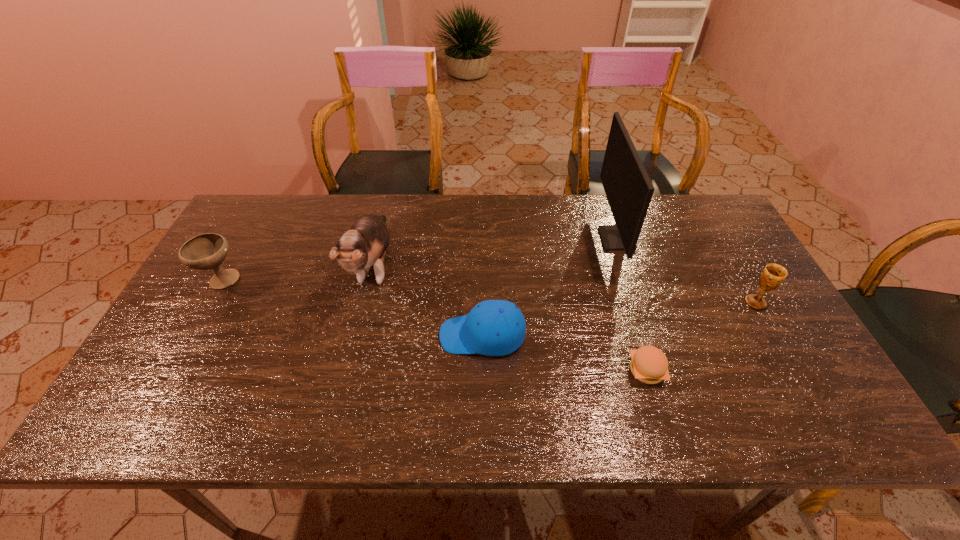
At what (x,y) coordinates should I click in order to perform the action: click on vacant point that satisfies the following two spatial constraints: 1. on the front-facing side of the tallest object; 2. at the face of the fifth object from right to left. Please return your answer as a coordinate pair (x, y). The image size is (960, 540). Looking at the image, I should click on (625, 266).

Where is `free space that satisfies the following two spatial constraints: 1. on the front-facing side of the rightmost object; 2. on the right side of the computer monitor`? This screenshot has width=960, height=540. free space that satisfies the following two spatial constraints: 1. on the front-facing side of the rightmost object; 2. on the right side of the computer monitor is located at coordinates (637, 302).

You are a GUI agent. You are given a task and a screenshot of the screen. Output one action in this format:
    pyautogui.click(x=<x>, y=<y>)
    Task: Click on the vacant space that satisfies the following two spatial constraints: 1. at the face of the right chalice; 2. on the left side of the cat
    Image resolution: width=960 pixels, height=540 pixels.
    Given the screenshot: What is the action you would take?
    pyautogui.click(x=366, y=302)

What are the coordinates of `vacant position in the image that satisfies the following two spatial constraints: 1. on the front-facing side of the computer monitor; 2. on the right side of the right chalice` in the screenshot? It's located at (637, 302).